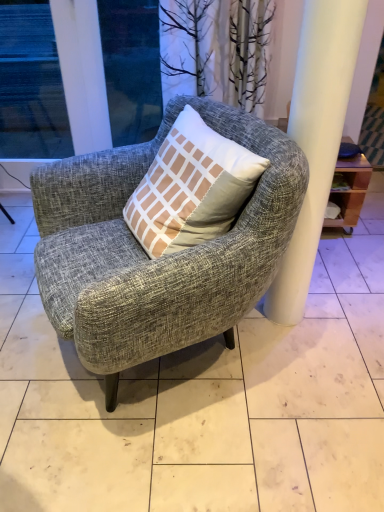
Question: Is textured gray armchair at center oriented away from gray fabric chair at center?

Choices:
 (A) yes
 (B) no

Answer: (A)

Question: Is textured gray armchair at center closer to the viewer compared to gray fabric chair at center?

Choices:
 (A) yes
 (B) no

Answer: (A)

Question: Is the surface of textured gray armchair at center in direct contact with gray fabric chair at center?

Choices:
 (A) yes
 (B) no

Answer: (B)

Question: Considering the relative positions of textured gray armchair at center and gray fabric chair at center in the image provided, is textured gray armchair at center to the left of gray fabric chair at center from the viewer's perspective?

Choices:
 (A) no
 (B) yes

Answer: (B)

Question: Could you tell me if textured gray armchair at center is turned towards gray fabric chair at center?

Choices:
 (A) yes
 (B) no

Answer: (B)

Question: Choose the correct answer: Is transparent glass window at upper left, which ranks as the 1th window in left-to-right order, inside transparent glass window at upper left, which is the second window in left-to-right order, or outside it?

Choices:
 (A) outside
 (B) inside

Answer: (A)

Question: Considering the positions of transparent glass window at upper left, the second window when ordered from right to left, and transparent glass window at upper left, positioned as the first window in right-to-left order, in the image, is transparent glass window at upper left, the second window when ordered from right to left, bigger or smaller than transparent glass window at upper left, positioned as the first window in right-to-left order,?

Choices:
 (A) small
 (B) big

Answer: (B)

Question: Considering the relative positions of transparent glass window at upper left, which ranks as the 1th window in left-to-right order, and transparent glass window at upper left, which is the second window in left-to-right order, in the image provided, is transparent glass window at upper left, which ranks as the 1th window in left-to-right order, to the left or to the right of transparent glass window at upper left, which is the second window in left-to-right order,?

Choices:
 (A) left
 (B) right

Answer: (A)

Question: Considering their positions, is transparent glass window at upper left, the second window when ordered from right to left, located in front of or behind transparent glass window at upper left, which is the second window in left-to-right order?

Choices:
 (A) front
 (B) behind

Answer: (A)

Question: Looking at their shapes, would you say transparent glass window at upper left, positioned as the first window in right-to-left order, is wider or thinner than transparent glass window at upper left, which ranks as the 1th window in left-to-right order?

Choices:
 (A) thin
 (B) wide

Answer: (A)

Question: Based on their sizes in the image, would you say transparent glass window at upper left, positioned as the first window in right-to-left order, is bigger or smaller than transparent glass window at upper left, the second window when ordered from right to left?

Choices:
 (A) big
 (B) small

Answer: (B)

Question: Is point (144, 19) closer or farther from the camera than point (54, 123)?

Choices:
 (A) closer
 (B) farther

Answer: (A)

Question: From the image's perspective, is transparent glass window at upper left, positioned as the first window in right-to-left order, above or below transparent glass window at upper left, which ranks as the 1th window in left-to-right order?

Choices:
 (A) below
 (B) above

Answer: (B)

Question: Based on their positions, is transparent glass window at upper left, the second window when ordered from right to left, located to the left or right of textured gray armchair at center?

Choices:
 (A) right
 (B) left

Answer: (B)

Question: Is point (34, 18) positioned closer to the camera than point (170, 321)?

Choices:
 (A) farther
 (B) closer

Answer: (A)